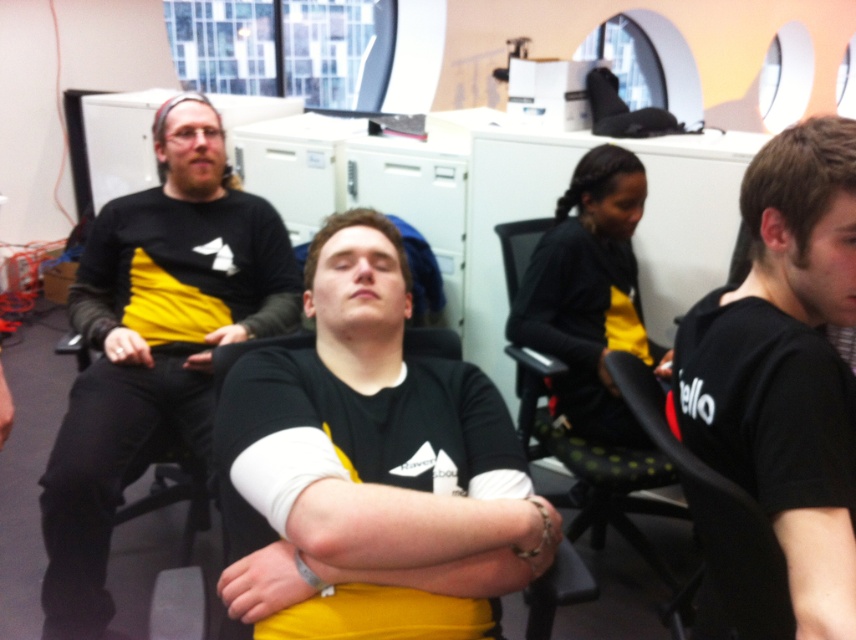
Looking at this image, how distant is black matte shirt at center from matte black shirt at left?

Answer: black matte shirt at center is 27.73 inches away from matte black shirt at left.

Which is below, black matte shirt at center or matte black shirt at left?

black matte shirt at center is below.

Which is in front, point (263, 609) or point (100, 520)?

Point (263, 609) is in front.

Where is `black matte shirt at center`? The height and width of the screenshot is (640, 856). black matte shirt at center is located at coordinates pos(376,464).

Which of these two, black matte arm at right or black mesh chair at right, stands shorter?

With less height is black matte arm at right.

Between point (852, 588) and point (773, 536), which one is positioned in front?

Point (852, 588) is in front.

Where is `black matte arm at right`? This screenshot has height=640, width=856. black matte arm at right is located at coordinates (810, 483).

Who is positioned more to the right, black matte shirt at right or black matte arm at right?

From the viewer's perspective, black matte shirt at right appears more on the right side.

Can you confirm if black matte shirt at right is positioned to the right of black matte arm at right?

Yes, black matte shirt at right is to the right of black matte arm at right.

Between point (723, 403) and point (834, 488), which one is positioned in front?

Point (834, 488) is more forward.

Image resolution: width=856 pixels, height=640 pixels. Identify the location of black matte shirt at right. (786, 365).